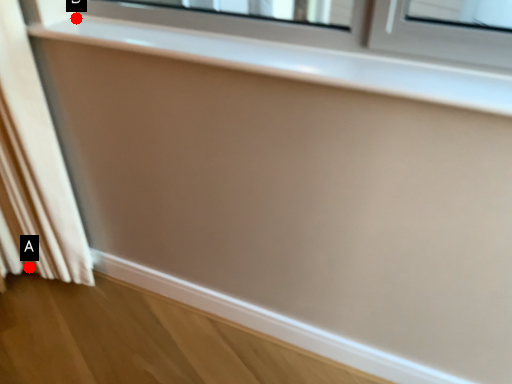
Question: Two points are circled on the image, labeled by A and B beside each circle. Which point is farther from the camera taking this photo?

Choices:
 (A) A is further
 (B) B is further

Answer: (A)